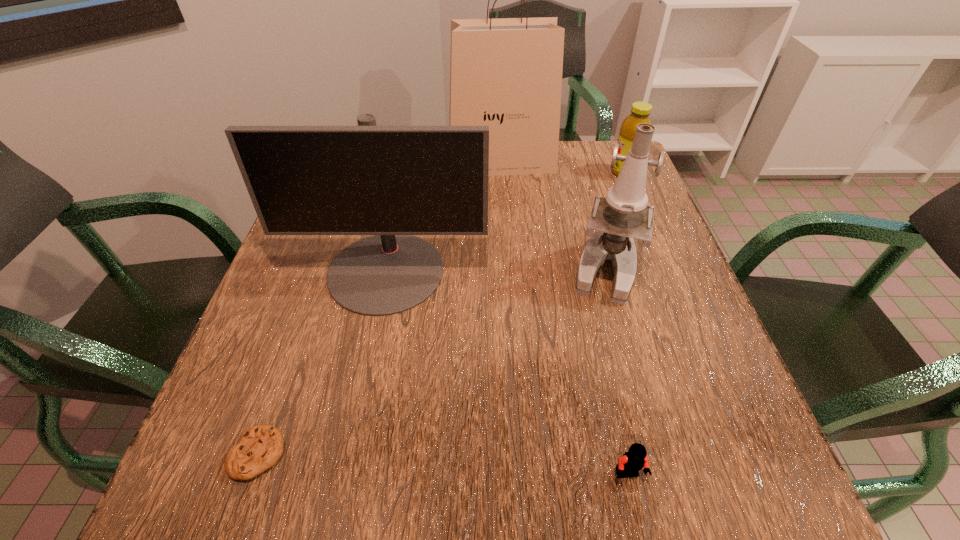
Image resolution: width=960 pixels, height=540 pixels. Find the location of `vacant space positioned 0.100m on the front label of the third shortest object`. vacant space positioned 0.100m on the front label of the third shortest object is located at coordinates (576, 172).

You are a GUI agent. You are given a task and a screenshot of the screen. Output one action in this format:
    pyautogui.click(x=<x>, y=<y>)
    Task: Click on the vacant position located on the front label of the third shortest object
    This screenshot has width=960, height=540.
    Given the screenshot: What is the action you would take?
    pyautogui.click(x=507, y=172)

I want to click on vacant area situated on the front label of the third shortest object, so click(538, 172).

The height and width of the screenshot is (540, 960). What are the coordinates of `vacant space located on the right of the shortest object` in the screenshot? It's located at (328, 454).

Identify the location of shopping bag that is at the far edge. This screenshot has height=540, width=960. (506, 73).

The width and height of the screenshot is (960, 540). Identify the location of fruit juice that is at the far edge. (640, 111).

Locate an element on the screen. The height and width of the screenshot is (540, 960). Lego that is at the near edge is located at coordinates (632, 461).

The width and height of the screenshot is (960, 540). What are the coordinates of `cookie located in the near edge section of the desktop` in the screenshot? It's located at (261, 446).

Where is `computer monitor that is at the left edge`? This screenshot has width=960, height=540. computer monitor that is at the left edge is located at coordinates (392, 182).

The height and width of the screenshot is (540, 960). Find the location of `cookie present at the left edge`. cookie present at the left edge is located at coordinates (261, 446).